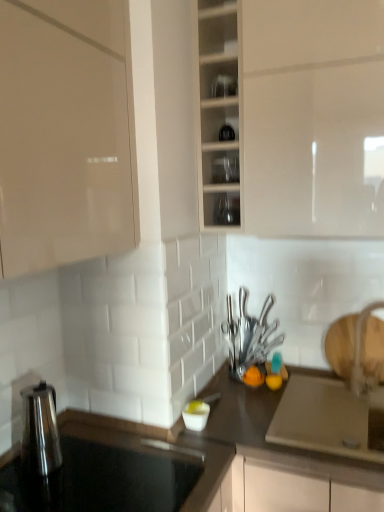
Where is `free location above dark gray laminate countertop at center, which is counted as the first countertop, starting from the bottom (from a real-world perspective)`? This screenshot has height=512, width=384. free location above dark gray laminate countertop at center, which is counted as the first countertop, starting from the bottom (from a real-world perspective) is located at coordinates (283, 385).